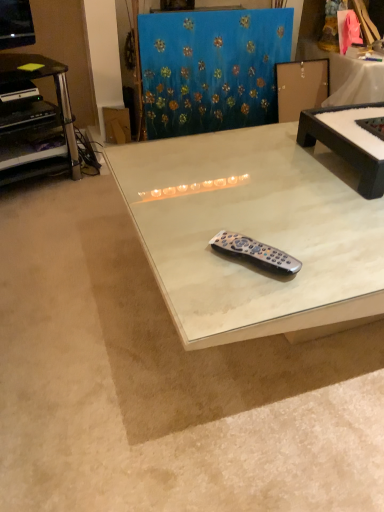
Find the location of a particular element. free space in front of black plastic desk at left is located at coordinates (41, 219).